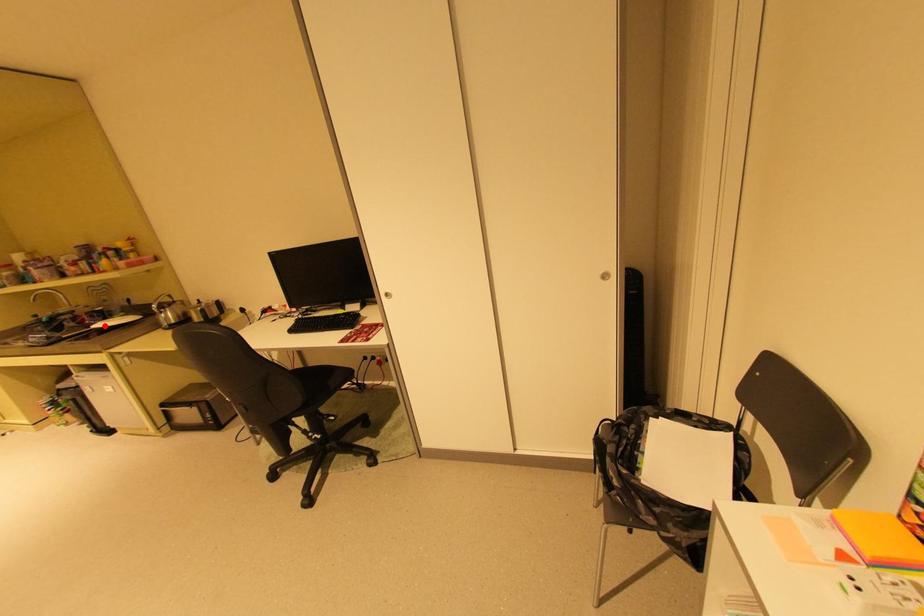
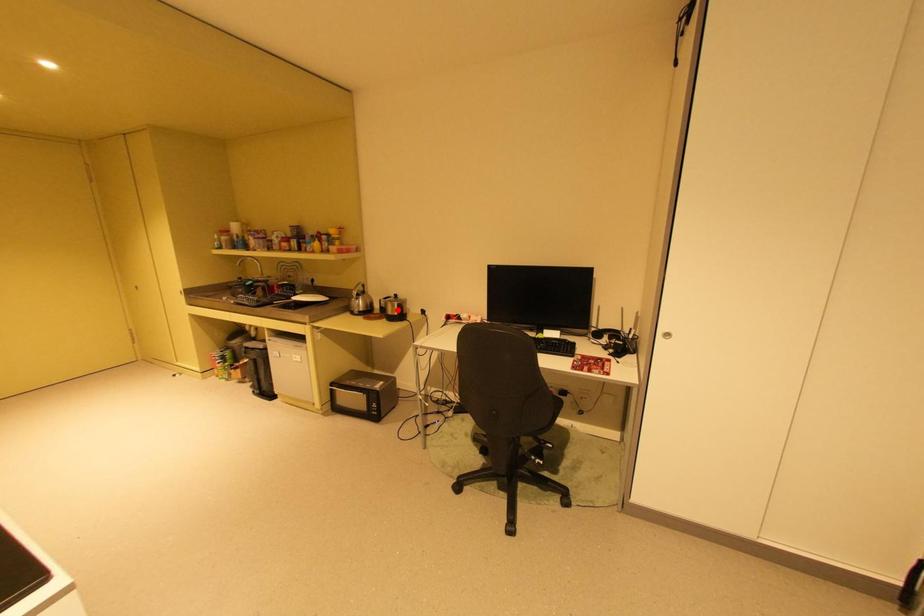
I am providing you with two images of the same scene from different viewpoints. A red point is marked on the first image and another point is marked on the second image. Is the marked point in image1 the same physical position as the marked point in image2?

No